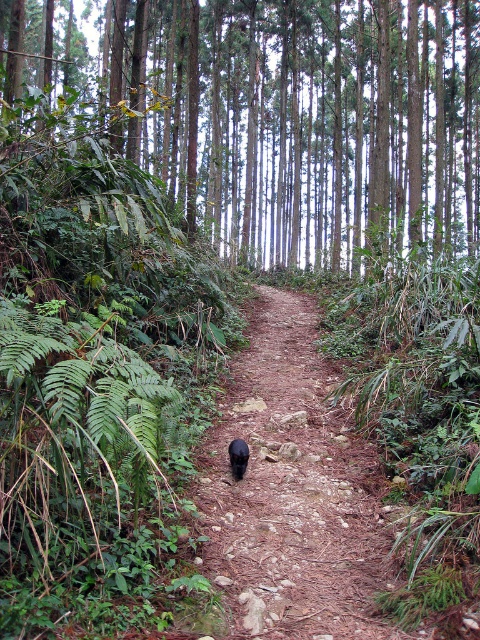
Question: Which point is closer to the camera?

Choices:
 (A) black fur cat at center
 (B) green smooth trees at center

Answer: (A)

Question: Can you confirm if green smooth trees at center is wider than black fur cat at center?

Choices:
 (A) yes
 (B) no

Answer: (A)

Question: Which point is closer to the camera?

Choices:
 (A) brown dirt path at center
 (B) green smooth trees at center
 (C) black fur cat at center

Answer: (A)

Question: Does brown dirt path at center appear over black fur cat at center?

Choices:
 (A) no
 (B) yes

Answer: (A)

Question: Estimate the real-world distances between objects in this image. Which object is closer to the brown dirt path at center?

Choices:
 (A) black fur cat at center
 (B) green smooth trees at center

Answer: (A)

Question: Can you confirm if green smooth trees at center is thinner than brown dirt path at center?

Choices:
 (A) no
 (B) yes

Answer: (A)